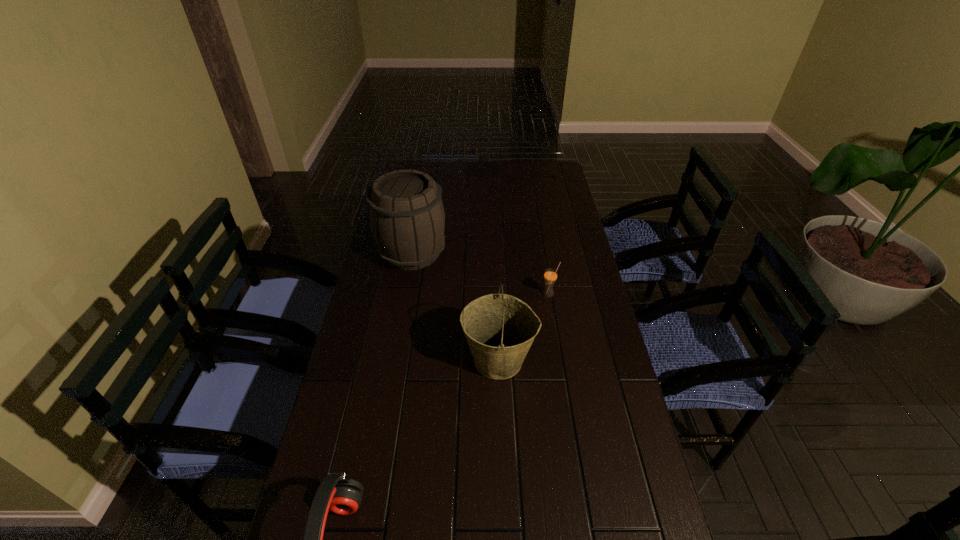
Locate an element on the screen. the left wine bucket is located at coordinates (406, 215).

I want to click on the farther wine bucket, so click(x=406, y=215).

I want to click on the nearer wine bucket, so click(500, 329).

I want to click on the right wine bucket, so [500, 329].

Where is `the rightmost object`? This screenshot has height=540, width=960. the rightmost object is located at coordinates (550, 276).

This screenshot has width=960, height=540. I want to click on straw, so click(550, 276).

This screenshot has width=960, height=540. In order to click on vacant space located 0.370m on the right of the farther wine bucket in this screenshot , I will do `click(546, 253)`.

Identify the location of free space located on the front of the right wine bucket. (501, 418).

Locate an element on the screen. The image size is (960, 540). vacant space located on the right of the rightmost object is located at coordinates (592, 294).

At what (x,y) coordinates should I click in order to perform the action: click on object at the left edge. Please return your answer as a coordinate pair (x, y). The image size is (960, 540). Looking at the image, I should click on (406, 215).